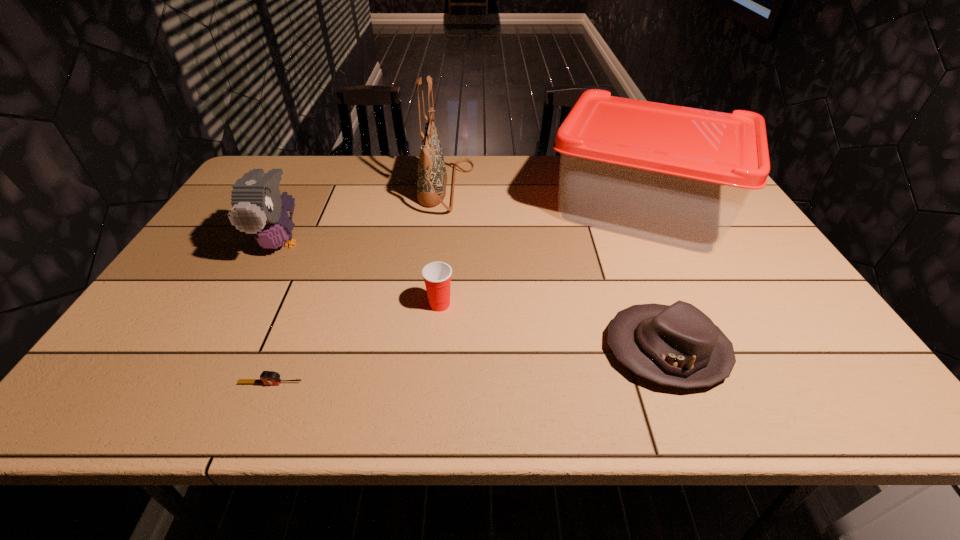
Identify the location of unoccupied area between the leftmost object and the Dixie cup. The height and width of the screenshot is (540, 960). (361, 273).

In order to click on vacant area that lies between the hat and the Dixie cup in this screenshot , I will do coord(553,327).

The height and width of the screenshot is (540, 960). In order to click on vacant area between the tallest object and the tray in this screenshot , I will do `click(542, 198)`.

Where is `free space between the hat and the Dixie cup`? The height and width of the screenshot is (540, 960). free space between the hat and the Dixie cup is located at coordinates (553, 327).

Locate an element on the screen. The image size is (960, 540). free area in between the Dixie cup and the second tallest object is located at coordinates (540, 256).

Image resolution: width=960 pixels, height=540 pixels. Find the location of `object that can be found as the second closest to the leftmost object`. object that can be found as the second closest to the leftmost object is located at coordinates (267, 377).

At what (x,y) coordinates should I click in order to perform the action: click on object that is the fifth nearest to the tallest object. Please return your answer as a coordinate pair (x, y). This screenshot has height=540, width=960. Looking at the image, I should click on (267, 377).

Identify the location of vacant area that satisfies the following two spatial constraints: 1. on the front-facing side of the handbag; 2. on the left side of the Dixie cup. The height and width of the screenshot is (540, 960). (434, 304).

The height and width of the screenshot is (540, 960). I want to click on free space that satisfies the following two spatial constraints: 1. on the front-facing side of the tallest object; 2. on the back side of the Dixie cup, so click(434, 304).

Find the location of a particular element. free spot that satisfies the following two spatial constraints: 1. on the front-facing side of the handbag; 2. at the beak of the fourth shortest object is located at coordinates (441, 242).